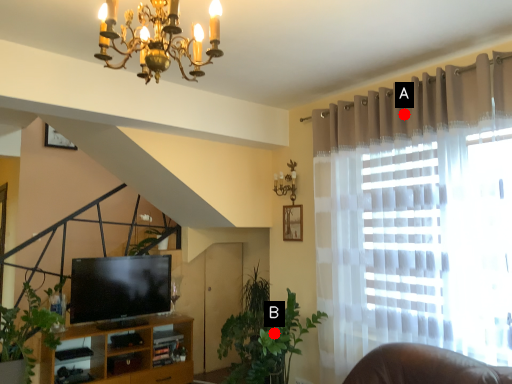
Question: Two points are circled on the image, labeled by A and B beside each circle. Which point is closer to the camera?

Choices:
 (A) A is closer
 (B) B is closer

Answer: (A)